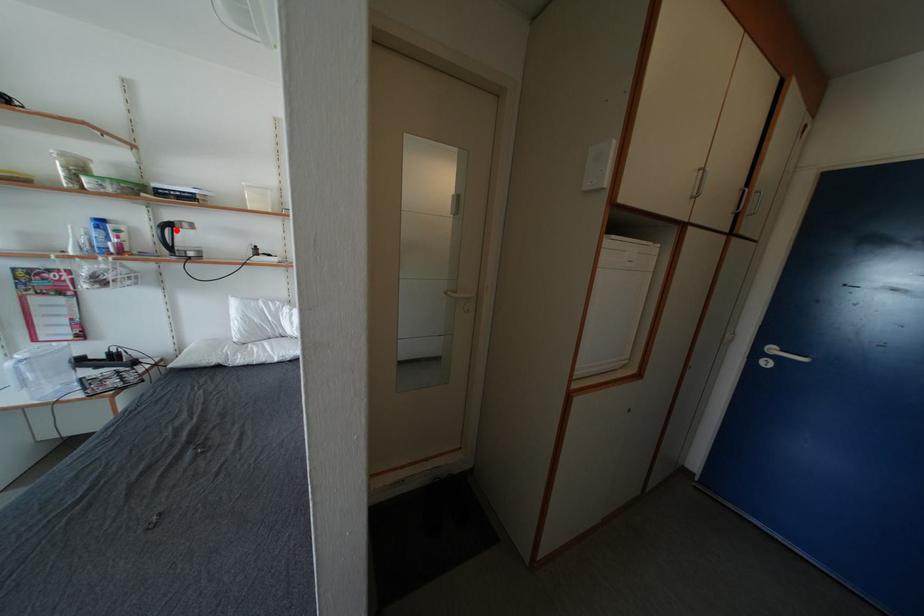
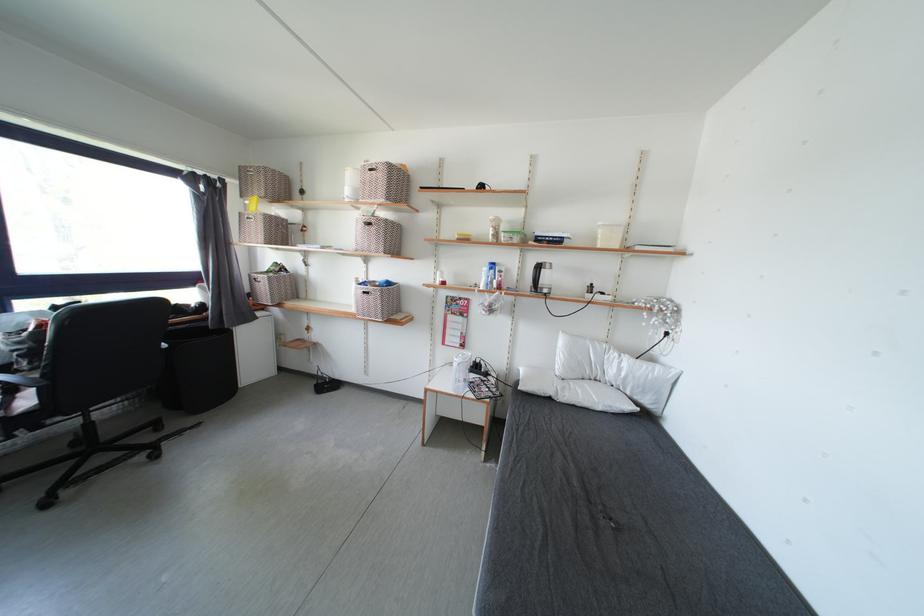
In the second image, find the point that corresponds to the highlighted location in the first image.

(545, 270)